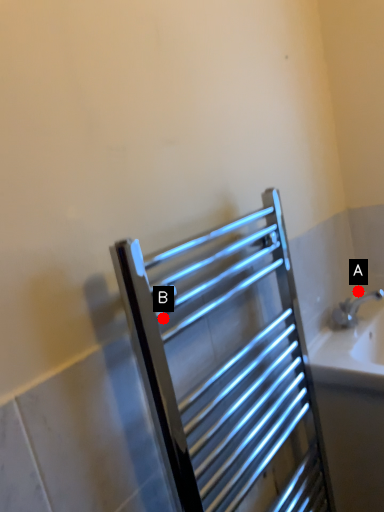
Question: Two points are circled on the image, labeled by A and B beside each circle. Which point is farther to the camera?

Choices:
 (A) A is further
 (B) B is further

Answer: (A)